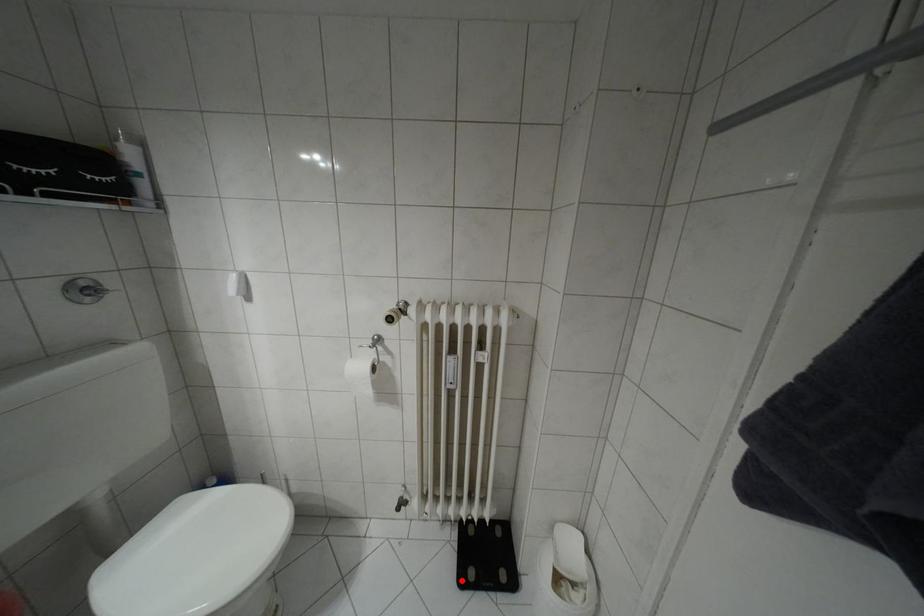
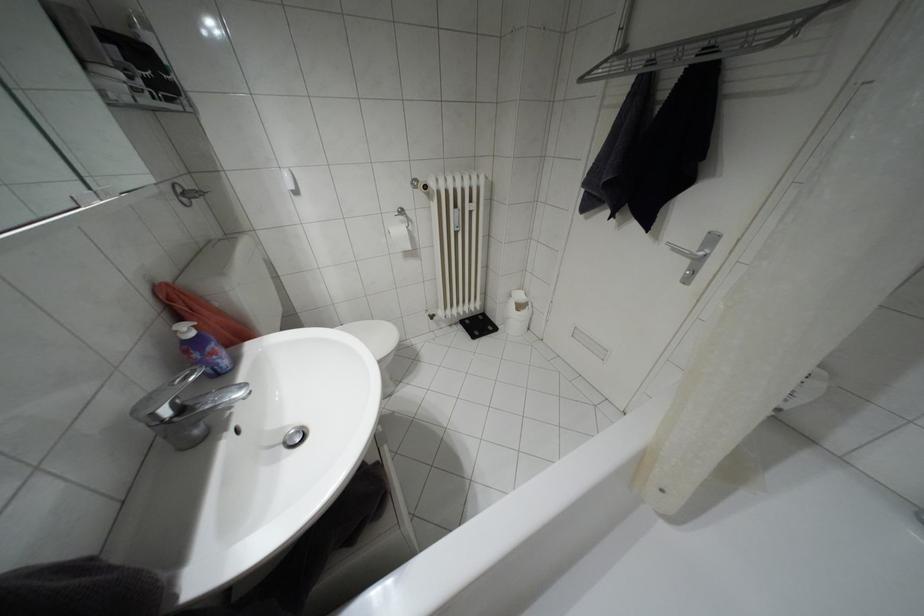
Locate, in the second image, the point that corresponds to the highlighted location in the first image.

(472, 336)